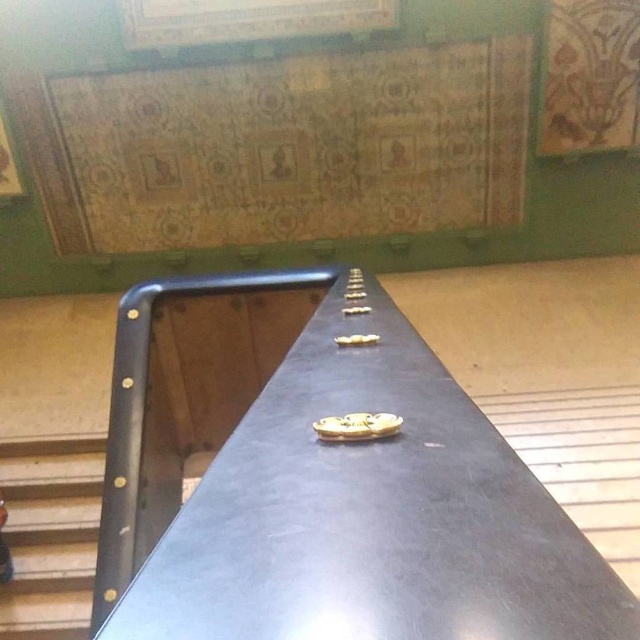
Does point (19, 552) come farther from viewer compared to point (605, 412)?

No, it is not.

Which is in front, point (1, 472) or point (637, 445)?

Point (637, 445) is in front.

Measure the distance between wooden stairs at lower left and camera.

wooden stairs at lower left is 8.23 feet away from camera.

Locate an element on the screen. The width and height of the screenshot is (640, 640). wooden stairs at lower left is located at coordinates (51, 536).

Image resolution: width=640 pixels, height=640 pixels. Identify the location of wooden stairs at lower left. (51, 536).

Is wooden stairs at lower left to the right of wooden bulletin board at upper center from the viewer's perspective?

No, wooden stairs at lower left is not to the right of wooden bulletin board at upper center.

At what (x,y) coordinates should I click in order to perform the action: click on wooden stairs at lower left. Please return your answer as a coordinate pair (x, y). Looking at the image, I should click on (51, 536).

The height and width of the screenshot is (640, 640). In order to click on smooth gray stair at center in this screenshot , I will do `click(582, 460)`.

Does smooth gray stair at center come in front of wooden bulletin board at upper center?

Yes, it is.

You are a GUI agent. You are given a task and a screenshot of the screen. Output one action in this format:
    pyautogui.click(x=<x>, y=<y>)
    Task: Click on the smooth gray stair at center
    The image size is (640, 640).
    Given the screenshot: What is the action you would take?
    pyautogui.click(x=582, y=460)

At what (x,y) coordinates should I click in order to perform the action: click on smooth gray stair at center. Please return your answer as a coordinate pair (x, y). Looking at the image, I should click on (582, 460).